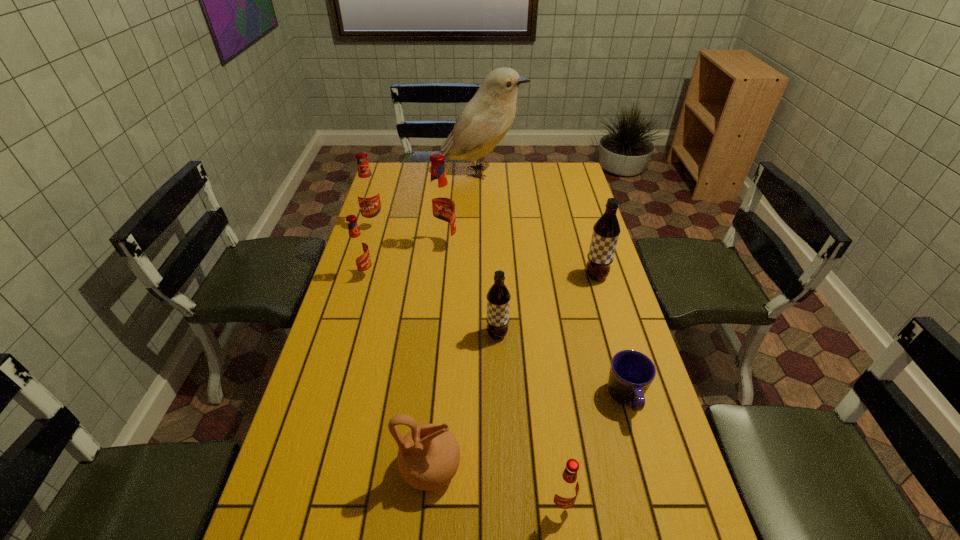
I want to click on free location located 0.330m on the back of the second smallest red root beer, so click(x=382, y=215).

Where is `blank space located 0.170m on the back of the nearer brown root beer`? blank space located 0.170m on the back of the nearer brown root beer is located at coordinates (495, 287).

At what (x,y) coordinates should I click in order to perform the action: click on vacant space located on the spout of the pottery. Please return your answer as a coordinate pair (x, y). The height and width of the screenshot is (540, 960). Looking at the image, I should click on (610, 468).

Locate an element on the screen. Image resolution: width=960 pixels, height=540 pixels. vacant region located 0.390m on the back of the smallest red root beer is located at coordinates (541, 352).

Find the location of a particular element. The width and height of the screenshot is (960, 540). free space located with the handle on the side of the mug is located at coordinates click(641, 454).

At what (x,y) coordinates should I click in order to perform the action: click on object present at the far edge. Please return your answer as a coordinate pair (x, y). Looking at the image, I should click on (483, 122).

Where is `root beer at the right edge`? This screenshot has width=960, height=540. root beer at the right edge is located at coordinates (606, 230).

The height and width of the screenshot is (540, 960). Identify the location of mug at the right edge. (631, 373).

Find the location of a particular element. The height and width of the screenshot is (540, 960). free region at the far edge of the desktop is located at coordinates (419, 168).

Locate an element on the screen. vacant space at the left edge is located at coordinates (x=361, y=345).